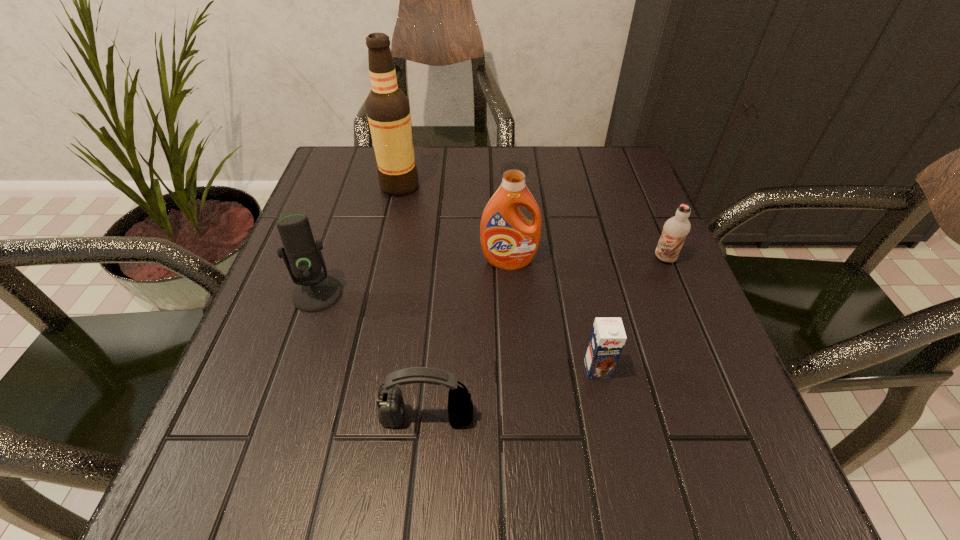
This screenshot has height=540, width=960. Find the location of `the tallest object`. the tallest object is located at coordinates (387, 107).

Where is `the second object from left to right`? The image size is (960, 540). the second object from left to right is located at coordinates (387, 107).

This screenshot has height=540, width=960. In order to click on the fifth shortest object in this screenshot , I will do (x=509, y=240).

This screenshot has width=960, height=540. Identify the location of detergent. (509, 240).

Locate an element on the screen. the leftmost object is located at coordinates (315, 291).

At what (x,y) coordinates should I click in order to perform the action: click on the third nearest object. Please return your answer as a coordinate pair (x, y). This screenshot has height=540, width=960. Looking at the image, I should click on (315, 291).

Where is `the rightmost object`? the rightmost object is located at coordinates (675, 229).

You are a GUI agent. You are given a task and a screenshot of the screen. Output one action in this format:
    pyautogui.click(x=<x>, y=<y>)
    Task: Click on the farther chocolate milk
    
    Given the screenshot: What is the action you would take?
    pyautogui.click(x=675, y=229)

The height and width of the screenshot is (540, 960). In order to click on the nearest object in this screenshot , I will do `click(390, 402)`.

The image size is (960, 540). Identify the location of the third object from left to right. (390, 402).